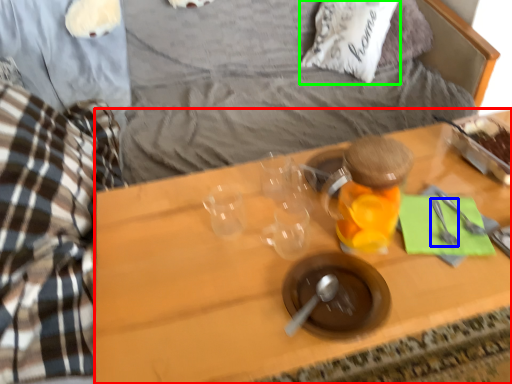
Question: Which is farther away from desk (highlighted by a red box)? silverware (highlighted by a blue box) or pillow (highlighted by a green box)?

Choices:
 (A) silverware
 (B) pillow

Answer: (B)